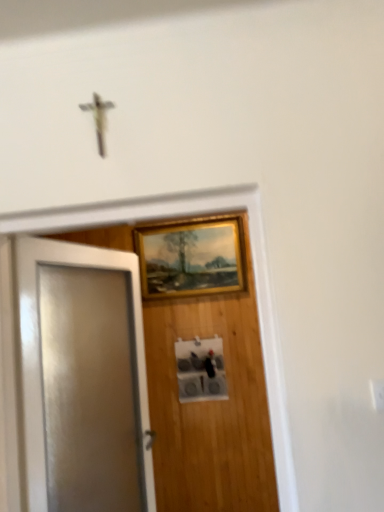
Question: Is white glossy door at left directly adjacent to gold/gilded picture frame at upper center?

Choices:
 (A) no
 (B) yes

Answer: (A)

Question: Is white glossy door at left bigger than gold/gilded picture frame at upper center?

Choices:
 (A) yes
 (B) no

Answer: (A)

Question: Could you tell me if white glossy door at left is turned towards gold/gilded picture frame at upper center?

Choices:
 (A) yes
 (B) no

Answer: (B)

Question: Considering the relative sizes of white glossy door at left and gold/gilded picture frame at upper center in the image provided, is white glossy door at left thinner than gold/gilded picture frame at upper center?

Choices:
 (A) no
 (B) yes

Answer: (A)

Question: From the image's perspective, is white glossy door at left over gold/gilded picture frame at upper center?

Choices:
 (A) no
 (B) yes

Answer: (A)

Question: Is the position of white glossy door at left less distant than that of gold/gilded picture frame at upper center?

Choices:
 (A) yes
 (B) no

Answer: (A)

Question: Considering the relative sizes of gold/gilded picture frame at upper center and white glossy door at left in the image provided, is gold/gilded picture frame at upper center wider than white glossy door at left?

Choices:
 (A) no
 (B) yes

Answer: (A)

Question: Is gold/gilded picture frame at upper center closer to the viewer compared to white glossy door at left?

Choices:
 (A) yes
 (B) no

Answer: (B)

Question: Does gold/gilded picture frame at upper center have a lesser height compared to white glossy door at left?

Choices:
 (A) no
 (B) yes

Answer: (B)

Question: Is gold/gilded picture frame at upper center far away from white glossy door at left?

Choices:
 (A) yes
 (B) no

Answer: (A)

Question: Considering the relative positions of gold/gilded picture frame at upper center and white glossy door at left in the image provided, is gold/gilded picture frame at upper center to the right of white glossy door at left from the viewer's perspective?

Choices:
 (A) yes
 (B) no

Answer: (A)

Question: Does gold/gilded picture frame at upper center turn towards white glossy door at left?

Choices:
 (A) yes
 (B) no

Answer: (A)

Question: Considering their positions, is white glossy door at left located in front of or behind gold/gilded picture frame at upper center?

Choices:
 (A) behind
 (B) front

Answer: (B)